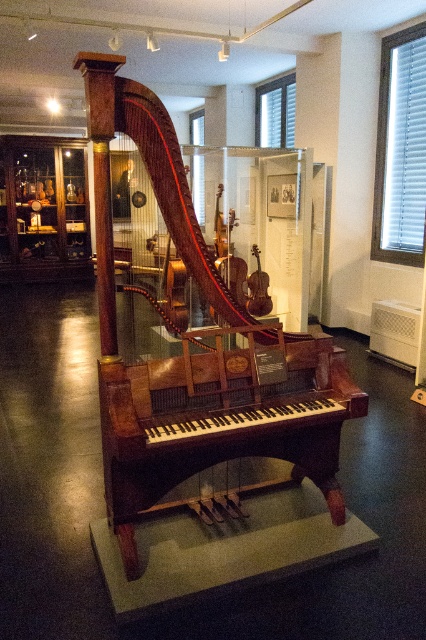
You are an interior designer planning to place a 1.8m tall sculpture in a room. You observe the wooden harpsichord at center and the mahogany wood harpsichord at center in the museum exhibit. Which one should you choose to ensure the sculpture will not block the view of the taller instrument?

The wooden harpsichord at center is taller than the mahogany wood harpsichord at center. Therefore, to ensure the sculpture does not block the view of the taller instrument, you should choose the wooden harpsichord at center as it is the taller one.

You are a museum curator arranging an exhibit. You have a mahogany wood harpsichord at center and a wooden violin at center. Which object is taller?

The mahogany wood harpsichord at center is much taller than the wooden violin at center.

You are a museum visitor standing in front of the wooden harpsichord at center. The museum has a strict rule that visitors must stay at least 4 meters away from all exhibits. Are you compliant with this rule?

The wooden harpsichord at center is 4.13 meters away from viewer, so yes, you are compliant with the museum rule since you are slightly beyond the required 4 meters distance.